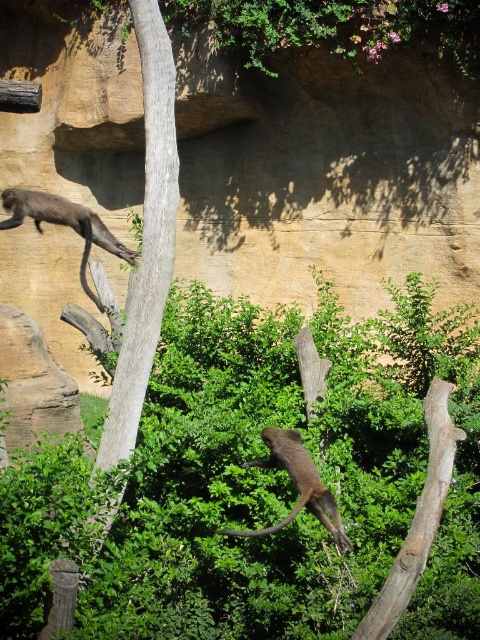
Question: Based on their relative distances, which object is farther from the brown furry monkey at center?

Choices:
 (A) brown rough tree trunk at center
 (B) brown furry monkey at upper left

Answer: (B)

Question: Among these points, which one is farthest from the camera?

Choices:
 (A) (160, 136)
 (B) (244, 534)
 (C) (95, 234)

Answer: (C)

Question: Is brown rough tree trunk at center further to camera compared to brown furry monkey at upper left?

Choices:
 (A) yes
 (B) no

Answer: (B)

Question: Estimate the real-world distances between objects in this image. Which object is closer to the brown furry monkey at upper left?

Choices:
 (A) brown rough tree trunk at center
 (B) brown furry monkey at center

Answer: (A)

Question: From the image, what is the correct spatial relationship of brown rough tree trunk at center in relation to brown furry monkey at center?

Choices:
 (A) left
 (B) right

Answer: (A)

Question: Does brown rough tree trunk at center have a lesser width compared to brown furry monkey at upper left?

Choices:
 (A) yes
 (B) no

Answer: (A)